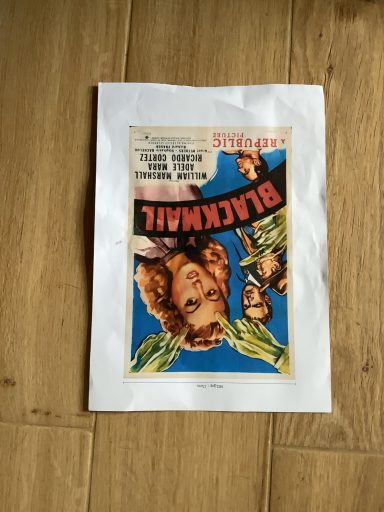
The height and width of the screenshot is (512, 384). Identify the location of blank space situated above matte paper poster at center (from a real-world perspective). click(x=211, y=241).